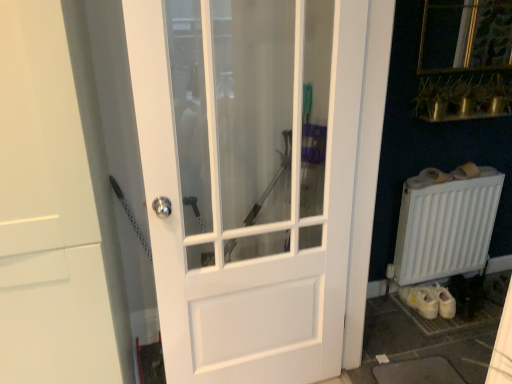
Question: From the image's perspective, is white matte radiator at lower right positioned above or below white glossy door at center, the first door when ordered from left to right?

Choices:
 (A) below
 (B) above

Answer: (A)

Question: Is white matte radiator at lower right spatially inside white glossy door at center, the first door when ordered from left to right, or outside of it?

Choices:
 (A) outside
 (B) inside

Answer: (A)

Question: Considering the real-world distances, which object is closest to the white glossy door at center, which appears as the first door when viewed from the right?

Choices:
 (A) white matte radiator at lower right
 (B) white glossy door at center, which is the 2th door in right-to-left order

Answer: (B)

Question: Which object is positioned farthest from the white matte radiator at lower right?

Choices:
 (A) white glossy door at center, arranged as the 2th door when viewed from the left
 (B) white glossy door at center, which is the 2th door in right-to-left order

Answer: (B)